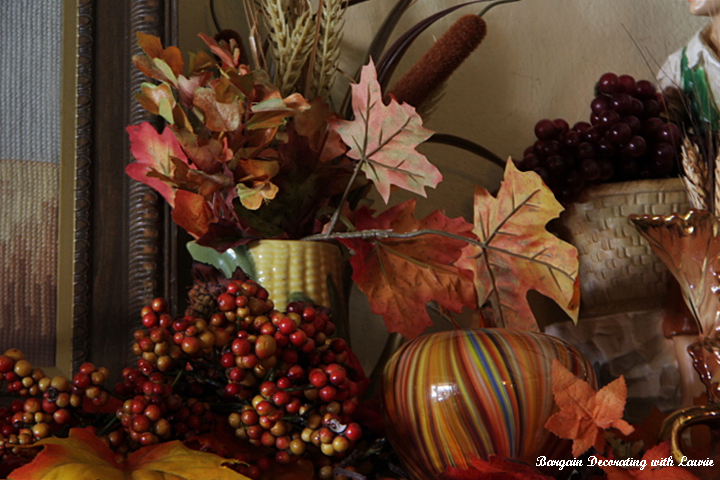
Where is `fake berry bunch`? fake berry bunch is located at coordinates (616, 136), (299, 400), (163, 345), (142, 406), (40, 390).